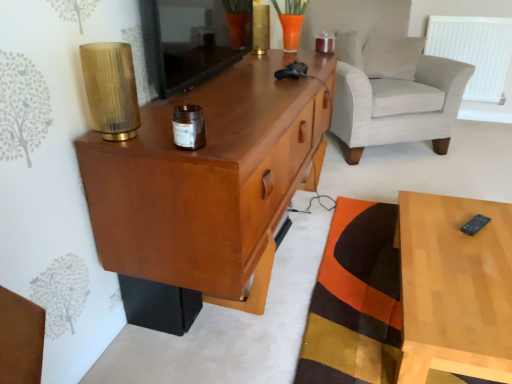
Identify the location of vacant area that lies between smooth wooden mirror at upper center and brown glass jar at center, which is counted as the 2th candle holder, starting from the back. (224, 94).